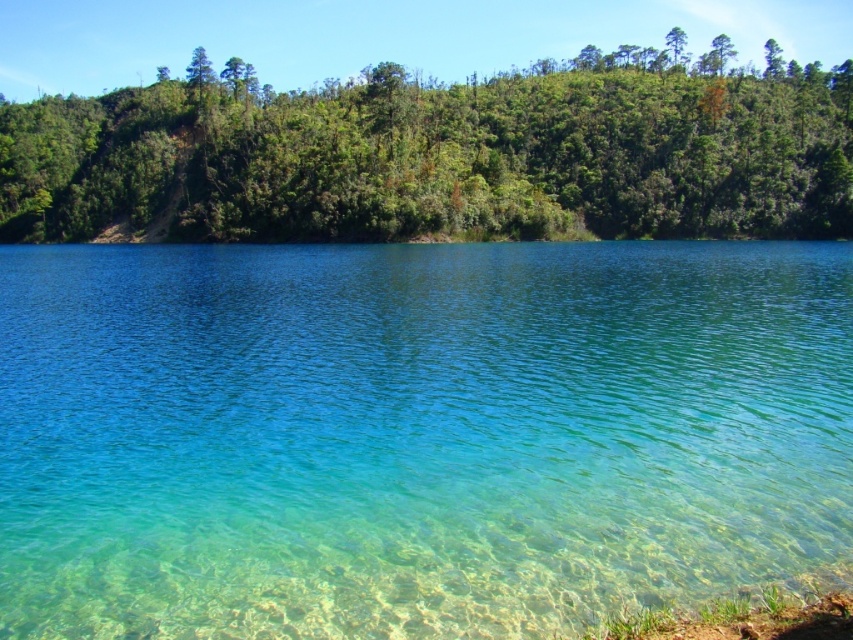
Question: Which of the following is the farthest from the observer?

Choices:
 (A) (676, 32)
 (B) (543, 97)
 (C) (234, 362)

Answer: (A)

Question: Estimate the real-world distances between objects in this image. Which object is closer to the clear water at center?

Choices:
 (A) green leafy trees at upper left
 (B) green leafy tree at upper center

Answer: (A)

Question: Is clear water at center smaller than green leafy trees at upper left?

Choices:
 (A) yes
 (B) no

Answer: (A)

Question: Can you confirm if clear water at center is positioned above green leafy tree at upper center?

Choices:
 (A) yes
 (B) no

Answer: (B)

Question: Among these points, which one is farthest from the camera?

Choices:
 (A) (668, 285)
 (B) (668, 49)

Answer: (B)

Question: Is clear water at center below green leafy trees at upper left?

Choices:
 (A) no
 (B) yes

Answer: (B)